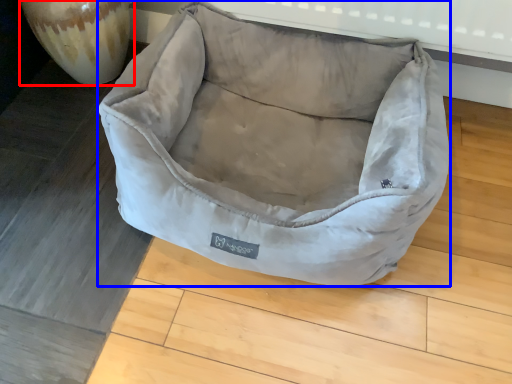
Question: Which point is further to the camera, glass vase (highlighted by a red box) or dog bed (highlighted by a blue box)?

Choices:
 (A) glass vase
 (B) dog bed

Answer: (A)